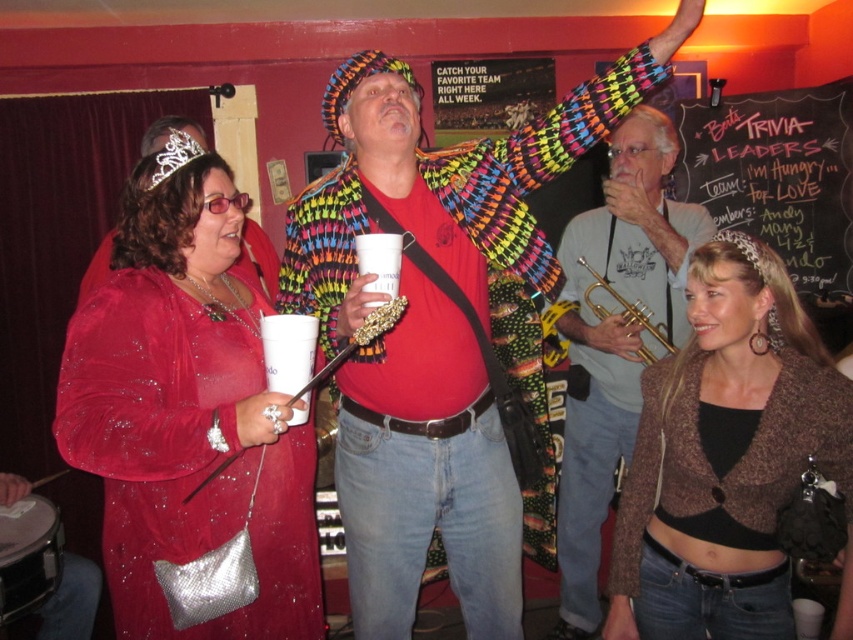
Between brown tweed jacket at center and matte gray shirt at center, which one has less height?

Standing shorter between the two is brown tweed jacket at center.

Can you confirm if brown tweed jacket at center is positioned below matte gray shirt at center?

Actually, brown tweed jacket at center is above matte gray shirt at center.

Between point (723, 337) and point (589, 468), which one is positioned behind?

Positioned behind is point (589, 468).

Where is `brown tweed jacket at center`? brown tweed jacket at center is located at coordinates click(729, 460).

Can you confirm if brushed metal drum at lower left is taller than metallic silver wand at center?

No, brushed metal drum at lower left is not taller than metallic silver wand at center.

Measure the distance from brushed metal drum at lower left to metallic silver wand at center.

brushed metal drum at lower left is 3.65 feet away from metallic silver wand at center.

Is point (54, 516) positioned after point (222, 465)?

Yes, point (54, 516) is farther from viewer.

Identify the location of brushed metal drum at lower left. (28, 556).

Does matte gray shirt at center have a greater height compared to gold shiny trumpet at center?

Yes.

Is point (582, 477) in front of point (648, 362)?

No, (582, 477) is behind (648, 362).

The height and width of the screenshot is (640, 853). I want to click on matte gray shirt at center, so click(x=614, y=339).